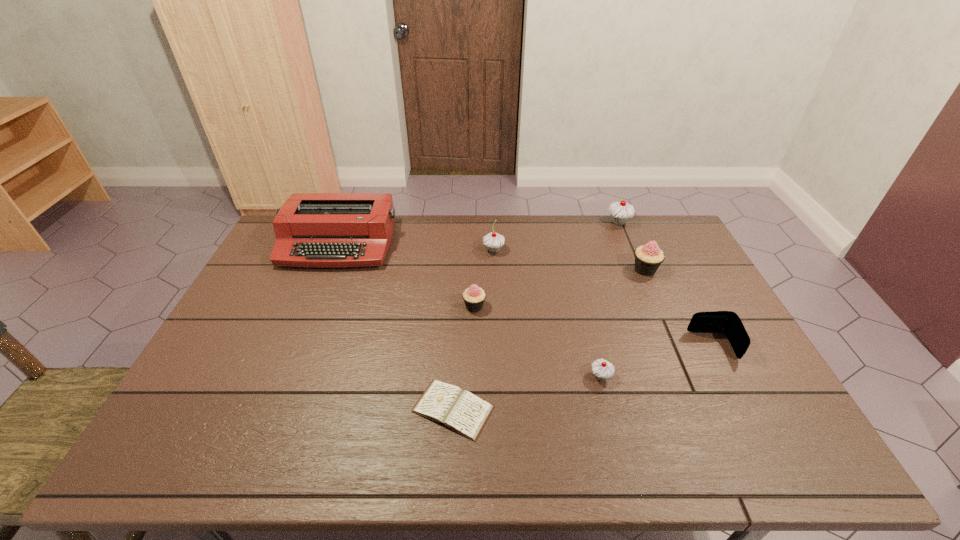
Find the location of a particular element. vacant space that satisfies the following two spatial constraints: 1. on the back side of the diary; 2. on the left side of the second farthest cupcake is located at coordinates (461, 250).

Where is `vacant point that satisfies the following two spatial constraints: 1. on the typing side of the typewriter; 2. on the left side of the shortest object`? vacant point that satisfies the following two spatial constraints: 1. on the typing side of the typewriter; 2. on the left side of the shortest object is located at coordinates (272, 409).